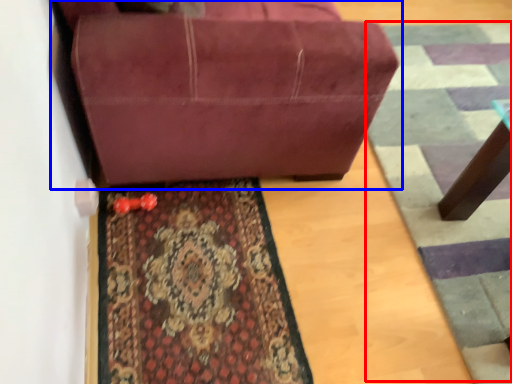
Question: Which object appears farthest to the camera in this image, doormat (highlighted by a red box) or studio couch (highlighted by a blue box)?

Choices:
 (A) doormat
 (B) studio couch

Answer: (A)